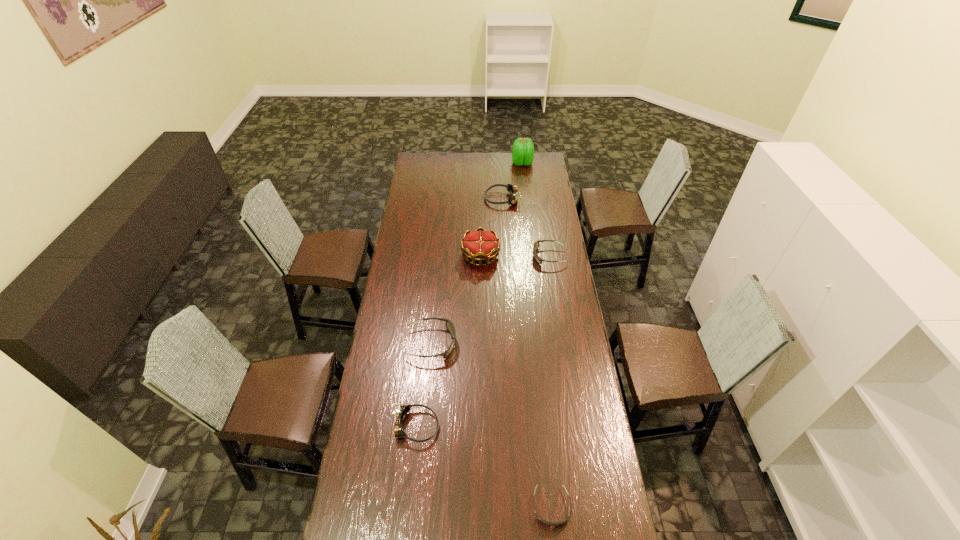
Where is `free location located through the lenses of the fourth farthest goggles`? Image resolution: width=960 pixels, height=540 pixels. free location located through the lenses of the fourth farthest goggles is located at coordinates (530, 426).

Locate an element on the screen. The width and height of the screenshot is (960, 540). free location located on the lenses of the farthest black goggles is located at coordinates (515, 256).

Identify the location of blank space located on the lenses of the farthest black goggles. (500, 256).

Where is `vacant space located on the lenses of the farthest black goggles`? vacant space located on the lenses of the farthest black goggles is located at coordinates (475, 256).

Find the location of a particular element. object that is at the far edge is located at coordinates (523, 150).

Identify the location of bell pepper positioned at the right edge. The width and height of the screenshot is (960, 540). (523, 150).

Identify the location of object located at the far right corner. This screenshot has width=960, height=540. (523, 150).

In the image, there is a desktop. At what (x,y) coordinates should I click in order to perform the action: click on vacant area at the far edge. Please return your answer as a coordinate pair (x, y). Looking at the image, I should click on (458, 153).

Locate an element on the screen. This screenshot has height=540, width=960. vacant area at the left edge of the desktop is located at coordinates (363, 498).

The image size is (960, 540). In the image, there is a desktop. What are the coordinates of `vacant space at the right edge` in the screenshot? It's located at (564, 329).